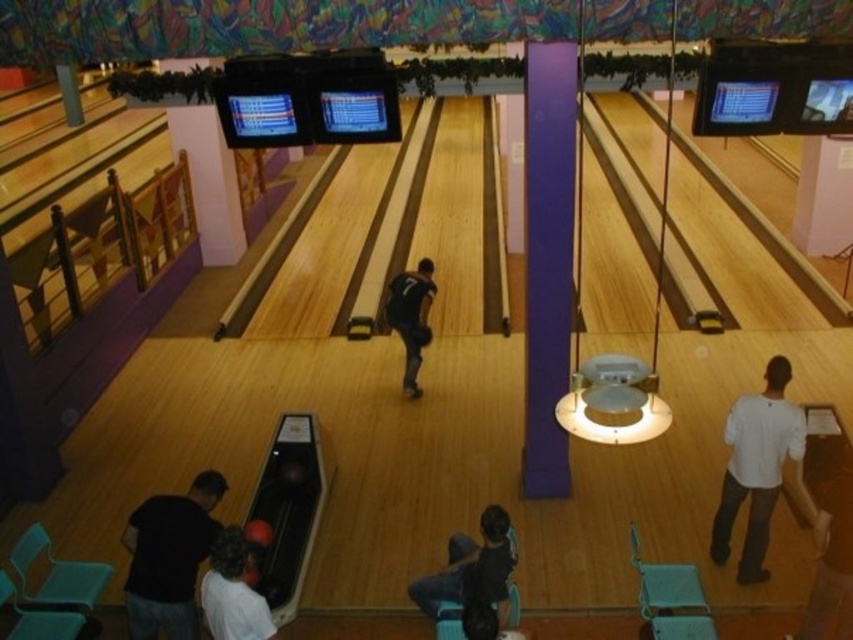
Is white matte shirt at right above black matte shirt at center?

Actually, white matte shirt at right is below black matte shirt at center.

In the scene shown: Can you confirm if white matte shirt at right is shorter than black matte shirt at center?

Incorrect, white matte shirt at right's height does not fall short of black matte shirt at center's.

Where is `white matte shirt at right`? This screenshot has width=853, height=640. white matte shirt at right is located at coordinates (756, 467).

Does white matte shirt at right have a lesser width compared to dark blue jeans at lower center?

Indeed, white matte shirt at right has a lesser width compared to dark blue jeans at lower center.

Does point (751, 554) come farther from viewer compared to point (485, 525)?

Yes, point (751, 554) is behind point (485, 525).

Who is more forward, (735,408) or (490,563)?

Point (490,563) is more forward.

Locate an element on the screen. white matte shirt at right is located at coordinates (756, 467).

Does point (212, 541) come closer to viewer compared to point (410, 298)?

Yes, it is.

Is black cotton shirt at lower left below black matte shirt at center?

Yes.

Which is in front, point (199, 547) or point (421, 332)?

Point (199, 547)

You are a GUI agent. You are given a task and a screenshot of the screen. Output one action in this format:
    pyautogui.click(x=<x>, y=<y>)
    Task: Click on the black cotton shirt at lower left
    This screenshot has width=853, height=640.
    Given the screenshot: What is the action you would take?
    pyautogui.click(x=169, y=557)